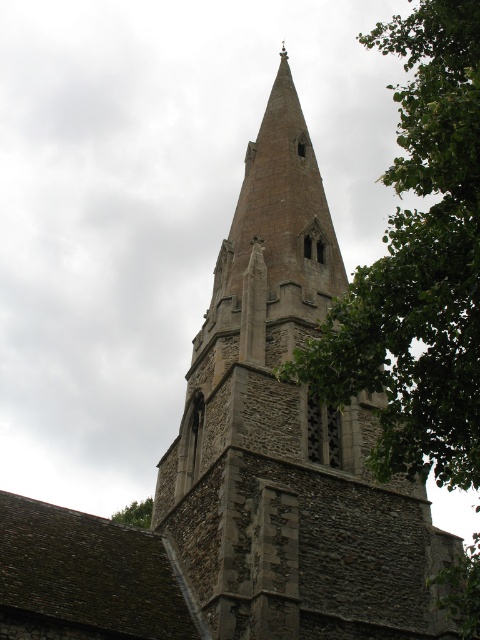
Based on the photo, you are standing in front of the historic stone church and notice a green leafy tree. Based on the image, can you determine the position of the green leafy tree at upper right relative to the church spire?

The green leafy tree at upper right is located at point coordinates approximately 0.416 along the horizontal axis and 0.873 along the vertical axis relative to the church spire.

You are standing in front of the historic stone church and notice two green leafy trees. One is the green leafy tree at upper right and the other is the green leafy tree at lower left. Which tree is positioned more to the east side of the church?

The green leafy tree at upper right is positioned more to the east side of the church compared to the green leafy tree at lower left.